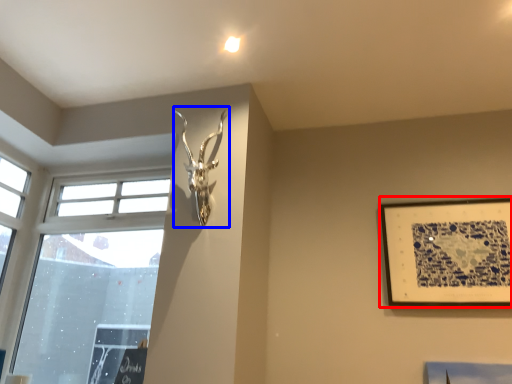
Question: Which object is closer to the camera taking this photo, picture frame (highlighted by a red box) or sculpture (highlighted by a blue box)?

Choices:
 (A) picture frame
 (B) sculpture

Answer: (B)